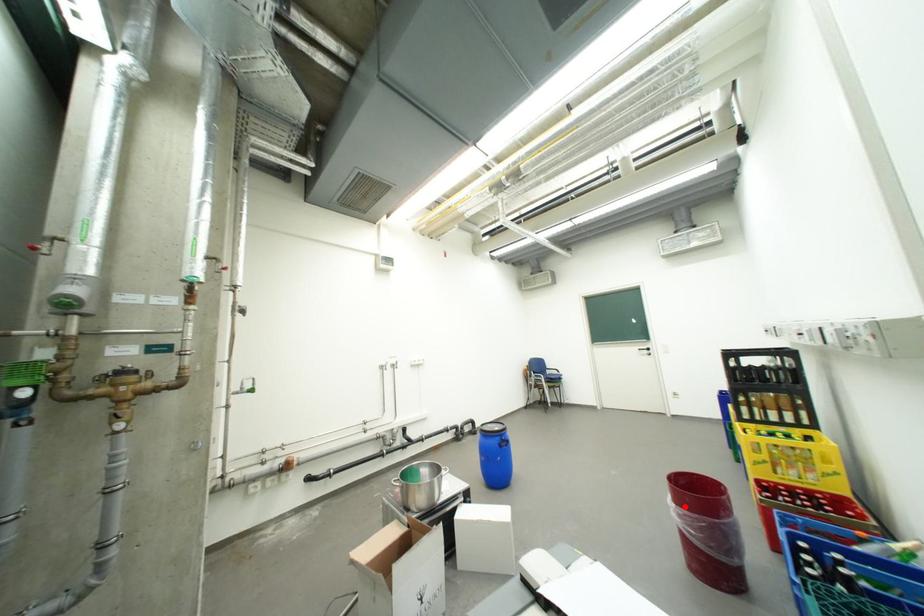
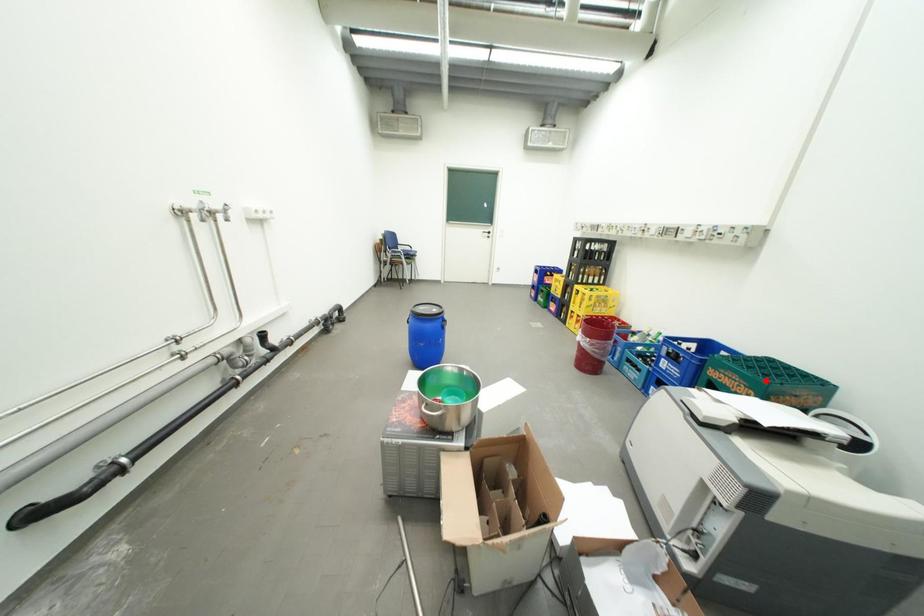
I am providing you with two images of the same scene from different viewpoints. A red point is marked on the first image and another point is marked on the second image. Does the point marked in image1 correspond to the same location as the one in image2?

No